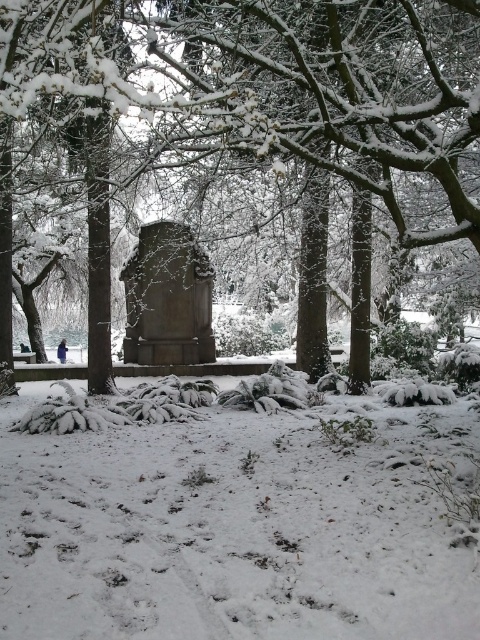
Question: Considering the real-world distances, which object is closest to the snow-covered stone monument at center?

Choices:
 (A) granite tombstone at center
 (B) white fluffy snow at center

Answer: (A)

Question: In this image, where is white fluffy snow at center located relative to granite tombstone at center?

Choices:
 (A) below
 (B) above

Answer: (A)

Question: Which is farther from the white fluffy snow at center?

Choices:
 (A) snow-covered stone monument at center
 (B) granite tombstone at center

Answer: (B)

Question: Which object is the farthest from the white fluffy snow at center?

Choices:
 (A) snow-covered stone monument at center
 (B) granite tombstone at center

Answer: (B)

Question: Does white fluffy snow at center lie in front of snow-covered stone monument at center?

Choices:
 (A) yes
 (B) no

Answer: (A)

Question: Can you confirm if snow-covered stone monument at center is positioned above granite tombstone at center?

Choices:
 (A) no
 (B) yes

Answer: (B)